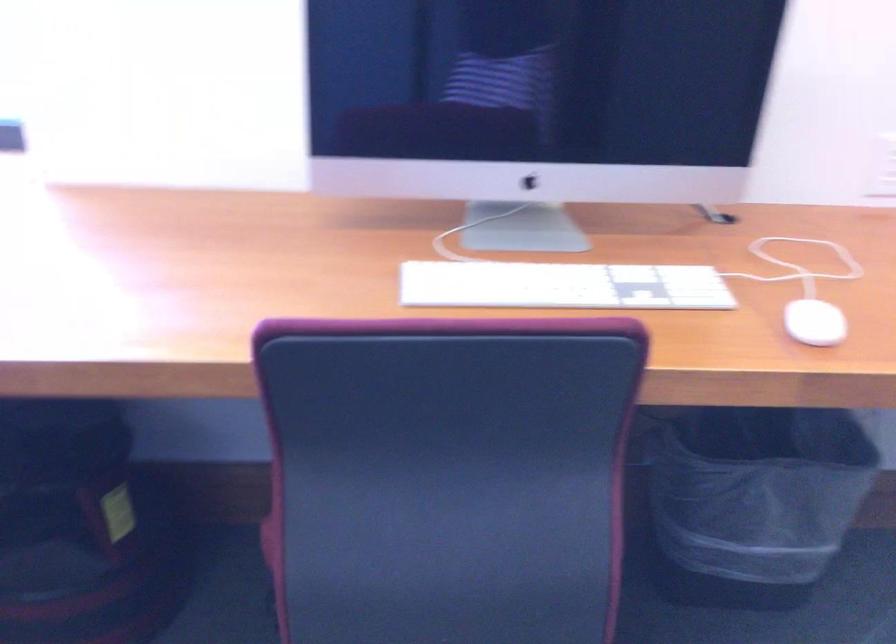
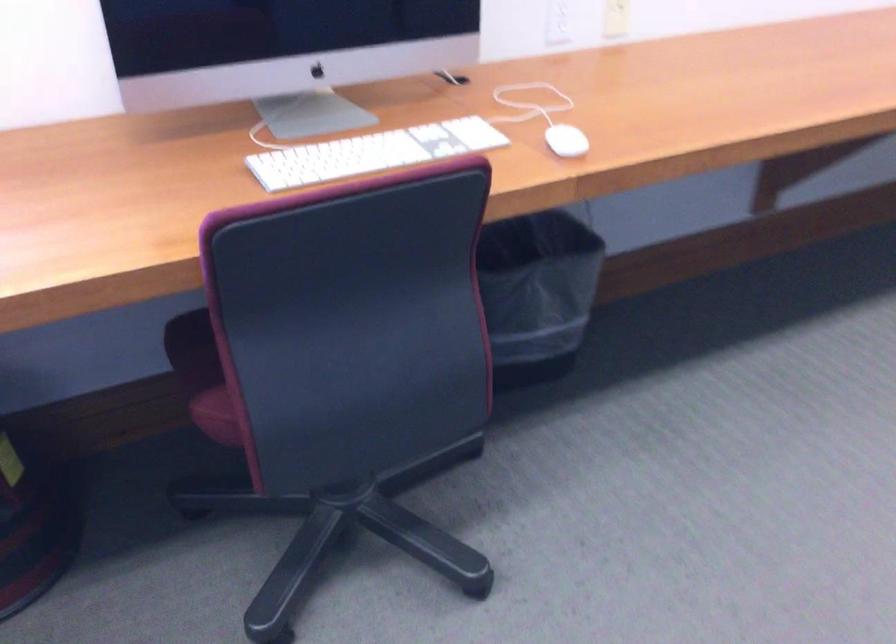
The point at [805,321] is marked in the first image. Where is the corresponding point in the second image?

(565, 140)